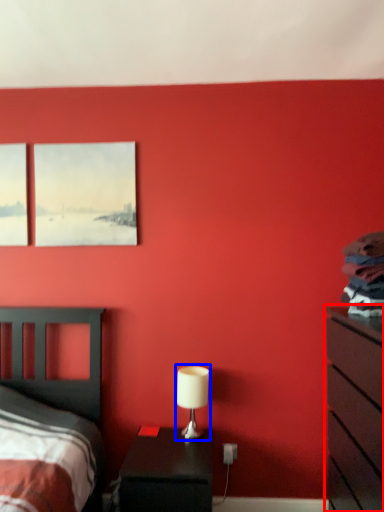
Question: Which object is closer to the camera taking this photo, chest of drawers (highlighted by a red box) or table lamp (highlighted by a blue box)?

Choices:
 (A) chest of drawers
 (B) table lamp

Answer: (A)